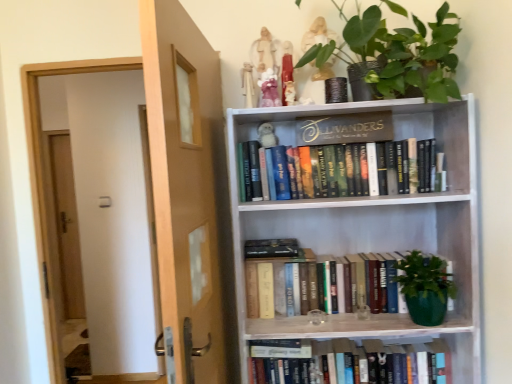
Question: Based on their positions, is matte white figurine at upper center, which is the first toy in right-to-left order, located to the left or right of green matte plant at upper center?

Choices:
 (A) left
 (B) right

Answer: (A)

Question: From the image's perspective, is matte white figurine at upper center, which is the first toy in right-to-left order, located above or below green matte plant at upper center?

Choices:
 (A) below
 (B) above

Answer: (A)

Question: Estimate the real-world distances between objects in this image. Which object is closer to the pink fabric doll at upper center, marked as the 3th toy in a left-to-right arrangement?

Choices:
 (A) brown wooden door at left
 (B) matte white figurine at upper center, which is the first toy in right-to-left order
 (C) white plush monkey at upper center, which appears as the 2th toy when viewed from the left
 (D) white porcelain owl at upper center, placed as the fourth toy when sorted from left to right
 (E) gold metallic sign at upper center

Answer: (D)

Question: Estimate the real-world distances between objects in this image. Which object is closer to the matte white figurine at upper center, which is the first toy in right-to-left order?

Choices:
 (A) brown wooden door at left
 (B) white fabric doll at upper center, which is the 1th toy from left to right
 (C) hardcover book at lower center, the 3th book in the top-to-bottom sequence
 (D) white porcelain owl at upper center, the second toy in the right-to-left sequence
 (E) pink fabric doll at upper center, marked as the 3th toy in a left-to-right arrangement

Answer: (D)